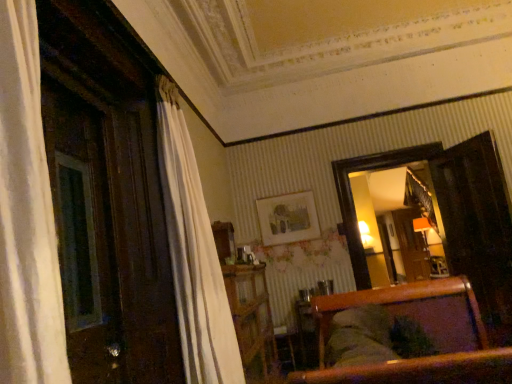
Question: Does point (377, 294) appear closer or farther from the camera than point (242, 342)?

Choices:
 (A) closer
 (B) farther

Answer: (A)

Question: Considering the positions of wooden armchair at center and wooden dresser at center in the image, is wooden armchair at center taller or shorter than wooden dresser at center?

Choices:
 (A) short
 (B) tall

Answer: (A)

Question: Which object is the closest to the matte wooden picture frame at center?

Choices:
 (A) wooden dresser at center
 (B) wooden armchair at center

Answer: (A)

Question: Based on their relative distances, which object is nearer to the matte wooden picture frame at center?

Choices:
 (A) wooden dresser at center
 (B) wooden armchair at center

Answer: (A)